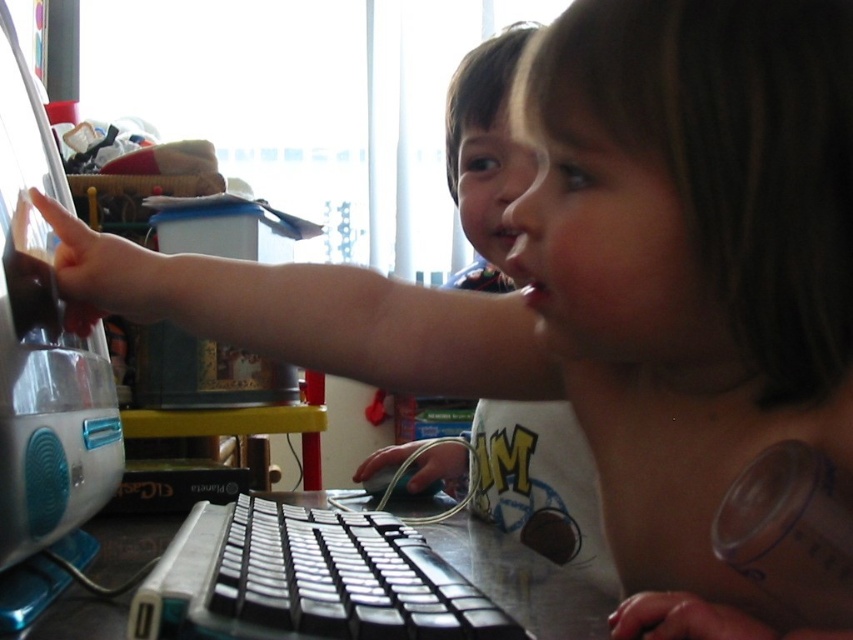
Question: Does teal plastic desktop computer at left have a smaller size compared to black plastic keyboard at center?

Choices:
 (A) yes
 (B) no

Answer: (B)

Question: Based on their relative distances, which object is farther from the matte black keyboard at center?

Choices:
 (A) teal plastic desktop computer at left
 (B) pink matte lips at center

Answer: (A)

Question: Which object is farther from the camera taking this photo?

Choices:
 (A) matte black keyboard at center
 (B) pink matte lips at center
 (C) black plastic keyboard at center
 (D) teal plastic desktop computer at left

Answer: (A)

Question: Does teal plastic desktop computer at left have a larger size compared to pink matte lips at center?

Choices:
 (A) yes
 (B) no

Answer: (A)

Question: Which point is closer to the camera taking this photo?

Choices:
 (A) (68, 547)
 (B) (519, 260)
 (C) (190, 579)

Answer: (C)

Question: Can you confirm if matte black keyboard at center is wider than pink matte lips at center?

Choices:
 (A) no
 (B) yes

Answer: (B)